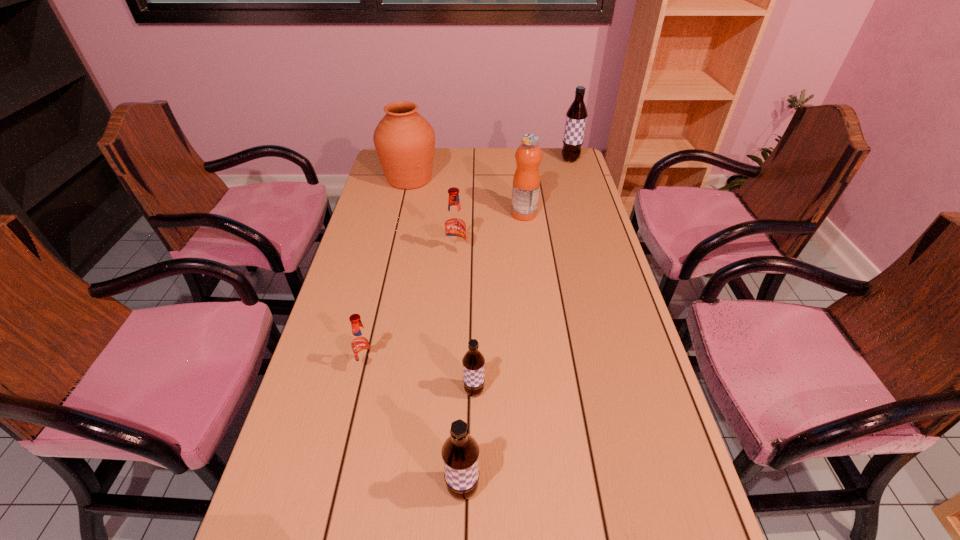
Where is `blank space located 0.090m on the right of the smallest brown root beer`? This screenshot has height=540, width=960. blank space located 0.090m on the right of the smallest brown root beer is located at coordinates (523, 391).

Where is `root beer that is at the far edge`? The height and width of the screenshot is (540, 960). root beer that is at the far edge is located at coordinates (576, 116).

The height and width of the screenshot is (540, 960). Find the location of `urn that is at the far edge`. urn that is at the far edge is located at coordinates (405, 142).

Where is `urn present at the left edge`? This screenshot has width=960, height=540. urn present at the left edge is located at coordinates (405, 142).

I want to click on root beer situated at the left edge, so click(x=362, y=345).

Where is `object present at the right edge`? The image size is (960, 540). object present at the right edge is located at coordinates (576, 116).

Locate an element on the screen. object present at the far left corner is located at coordinates (405, 142).

This screenshot has height=540, width=960. Identify the location of object at the far right corner. (576, 116).

Where is `free region at the far edge`? This screenshot has width=960, height=540. free region at the far edge is located at coordinates click(460, 164).

What are the coordinates of `vacant area at the left edge` in the screenshot? It's located at (348, 408).